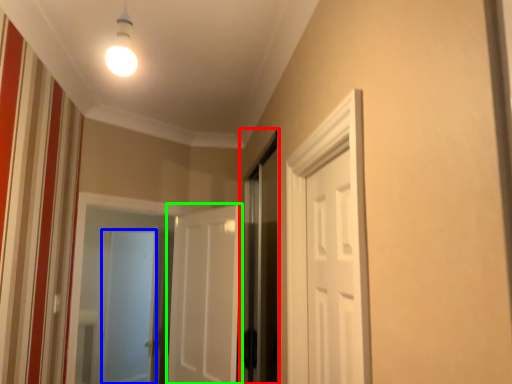
Question: Considering the real-world distances, which object is closest to screen door (highlighted by a red box)? screen door (highlighted by a blue box) or door (highlighted by a green box).

Choices:
 (A) screen door
 (B) door

Answer: (B)